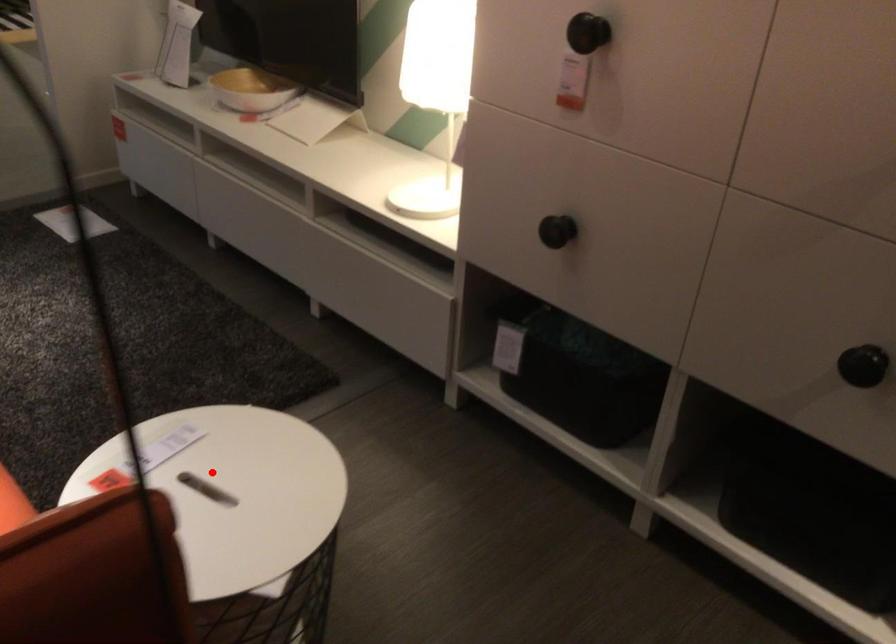
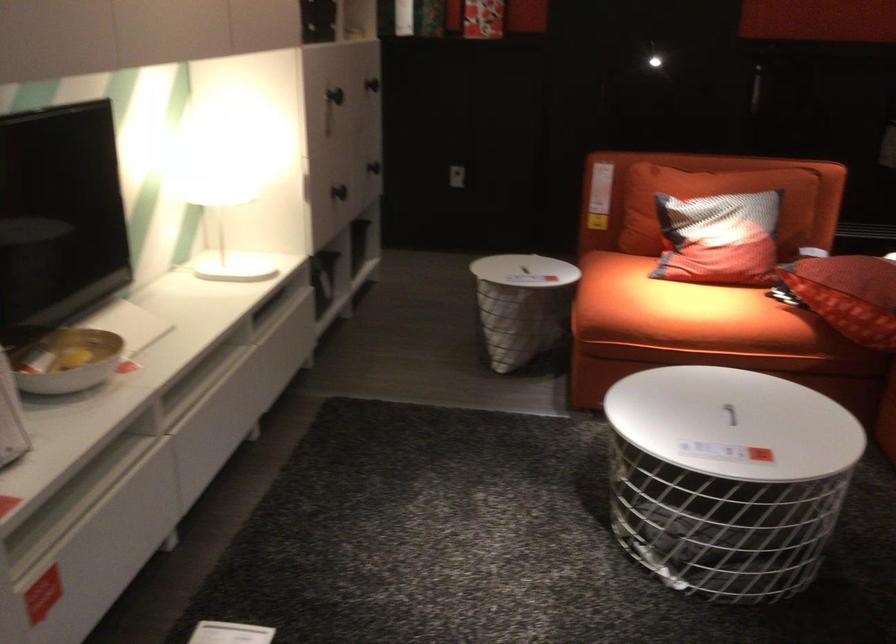
The point at the highlighted location is marked in the first image. Where is the corresponding point in the second image?

(522, 270)